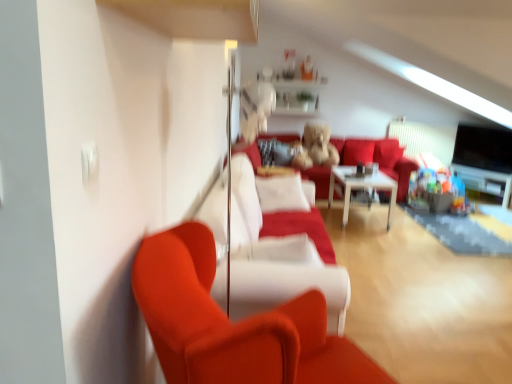
Measure the distance between velvet red couch at center, the first couch viewed from the front, and camera.

velvet red couch at center, the first couch viewed from the front, and camera are 1.86 meters apart from each other.

What do you see at coordinates (234, 324) in the screenshot? This screenshot has width=512, height=384. I see `matte red couch at left` at bounding box center [234, 324].

Where is `velvet red couch at center, the second couch viewed from the back`? velvet red couch at center, the second couch viewed from the back is located at coordinates (275, 260).

Is white glossy table at center not within velvet red couch at center, the first couch viewed from the front?

Yes.

Can you tell me how much white glossy table at center and velvet red couch at center, the second couch viewed from the back, differ in facing direction?

There is a 87.7-degree angle between the facing directions of white glossy table at center and velvet red couch at center, the second couch viewed from the back.

Is white glossy table at center further to the viewer compared to velvet red couch at center, the second couch viewed from the back?

Yes.

From a real-world perspective, is white glossy table at center under velvet red couch at center, the first couch viewed from the front?

Correct, in the physical world, white glossy table at center is lower than velvet red couch at center, the first couch viewed from the front.

Considering the positions of objects white glossy shelf at upper center and white glossy table at center in the image provided, who is in front, white glossy shelf at upper center or white glossy table at center?

white glossy table at center.

How many degrees apart are the facing directions of white glossy shelf at upper center and white glossy table at center?

white glossy shelf at upper center and white glossy table at center are facing 2.47 degrees away from each other.

From the image's perspective, is white glossy shelf at upper center above or below white glossy table at center?

white glossy shelf at upper center is situated higher than white glossy table at center in the image.

Is white glossy shelf at upper center far away from white glossy table at center?

That's right, there is a large distance between white glossy shelf at upper center and white glossy table at center.

Between matte red couch at left and white glossy shelf at upper center, which one has smaller width?

With smaller width is white glossy shelf at upper center.

Is matte red couch at left next to white glossy shelf at upper center and touching it?

They are not placed beside each other.

From the image's perspective, is matte red couch at left positioned above or below white glossy shelf at upper center?

matte red couch at left is situated lower than white glossy shelf at upper center in the image.

Between matte red couch at left and white glossy shelf at upper center, which one has smaller size?

With smaller size is white glossy shelf at upper center.

How far apart are velvet red couch at center, the second couch viewed from the back, and white glossy table at center?

velvet red couch at center, the second couch viewed from the back, and white glossy table at center are 2.35 meters apart from each other.

Consider the image. Considering the relative sizes of velvet red couch at center, the second couch viewed from the back, and white glossy table at center in the image provided, is velvet red couch at center, the second couch viewed from the back, bigger than white glossy table at center?

Yes.

From the picture: Considering the relative sizes of velvet red couch at center, the first couch viewed from the front, and white glossy table at center in the image provided, is velvet red couch at center, the first couch viewed from the front, wider than white glossy table at center?

No, velvet red couch at center, the first couch viewed from the front, is not wider than white glossy table at center.

Can you tell me how much velvet red couch at center, the second couch viewed from the back, and white glossy table at center differ in facing direction?

The facing directions of velvet red couch at center, the second couch viewed from the back, and white glossy table at center are 87.7 degrees apart.

Is white glossy shelf at upper center far from matte red couch at left?

Yes.

Considering the positions of objects white glossy shelf at upper center and matte red couch at left in the image provided, who is behind, white glossy shelf at upper center or matte red couch at left?

white glossy shelf at upper center is more distant.

Does white glossy shelf at upper center turn towards matte red couch at left?

Yes, white glossy shelf at upper center is facing matte red couch at left.

Is point (316, 89) closer to camera compared to point (207, 372)?

No, it is not.

Based on the photo, does velvet red couch at center, the first couch viewed from the front, have a greater width compared to matte red couch at left?

Yes.

Does point (224, 171) lie in front of point (313, 370)?

No.

From the image's perspective, is velvet red couch at center, the first couch viewed from the front, beneath matte red couch at left?

No, from the image's perspective, velvet red couch at center, the first couch viewed from the front, is not below matte red couch at left.

What's the angular difference between velvet red couch at center, the first couch viewed from the front, and matte red couch at left's facing directions?

27.6 degrees separate the facing orientations of velvet red couch at center, the first couch viewed from the front, and matte red couch at left.

Does white glossy table at center have a greater height compared to matte red couch at left?

In fact, white glossy table at center may be shorter than matte red couch at left.

Is white glossy table at center next to matte red couch at left?

No, white glossy table at center is not with matte red couch at left.

Locate an element on the screen. Image resolution: width=512 pixels, height=384 pixels. table lying above the matte red couch at left (from the image's perspective) is located at coordinates (361, 188).

From the image's perspective, who appears lower, white glossy table at center or matte red couch at left?

matte red couch at left, from the image's perspective.

Find the location of a particular element. Image resolution: width=512 pixels, height=384 pixels. couch located in front of the white glossy table at center is located at coordinates (275, 260).

You are a GUI agent. You are given a task and a screenshot of the screen. Output one action in this format:
    pyautogui.click(x=<x>, y=<y>)
    Task: Click on the shelf above the white glossy table at center (from a real-world perspective)
    This screenshot has height=384, width=512.
    Given the screenshot: What is the action you would take?
    pyautogui.click(x=289, y=95)

From the image, which object appears to be nearer to velvet red couch at center, the first couch viewed from the front, matte red couch at left or white glossy shelf at upper center?

matte red couch at left is positioned closer to the anchor velvet red couch at center, the first couch viewed from the front.

Which object lies further to the anchor point white glossy table at center, white glossy shelf at upper center or matte red couch at left?

Based on the image, matte red couch at left appears to be further to white glossy table at center.

Considering their positions, is white glossy table at center positioned further to velvet red couch at center, the first couch viewed from the front, than white glossy shelf at upper center?

Among the two, white glossy shelf at upper center is located further to velvet red couch at center, the first couch viewed from the front.

Which object lies nearer to the anchor point velvet red couch at center, the second couch viewed from the back, velvet red couch at center, placed as the first couch when sorted from back to front, or matte red couch at left?

matte red couch at left is positioned closer to the anchor velvet red couch at center, the second couch viewed from the back.

From the image, which object appears to be nearer to white glossy table at center, velvet red couch at center, which is counted as the second couch, starting from the front, or matte red couch at left?

Based on the image, velvet red couch at center, which is counted as the second couch, starting from the front, appears to be nearer to white glossy table at center.

From the picture: From the image, which object appears to be nearer to matte red couch at left, velvet red couch at center, placed as the first couch when sorted from back to front, or white glossy shelf at upper center?

The object closer to matte red couch at left is white glossy shelf at upper center.

When comparing their distances from velvet red couch at center, the second couch viewed from the back, does matte red couch at left or velvet red couch at center, which is counted as the second couch, starting from the front, seem closer?

matte red couch at left is closer to velvet red couch at center, the second couch viewed from the back.

When comparing their distances from white glossy shelf at upper center, does velvet red couch at center, which is counted as the second couch, starting from the front, or velvet red couch at center, the second couch viewed from the back, seem further?

The object further to white glossy shelf at upper center is velvet red couch at center, the second couch viewed from the back.

Locate an element on the screen. The height and width of the screenshot is (384, 512). table between velvet red couch at center, the first couch viewed from the front, and white glossy shelf at upper center, along the z-axis is located at coordinates (361, 188).

At what (x,y) coordinates should I click in order to perform the action: click on table between matte red couch at left and velvet red couch at center, placed as the first couch when sorted from back to front, along the z-axis. Please return your answer as a coordinate pair (x, y). The height and width of the screenshot is (384, 512). Looking at the image, I should click on (361, 188).

The width and height of the screenshot is (512, 384). Identify the location of couch between velvet red couch at center, the second couch viewed from the back, and white glossy shelf at upper center, along the z-axis. (380, 159).

Find the location of a particular element. This screenshot has width=512, height=384. couch between matte red couch at left and white glossy table at center along the z-axis is located at coordinates (275, 260).